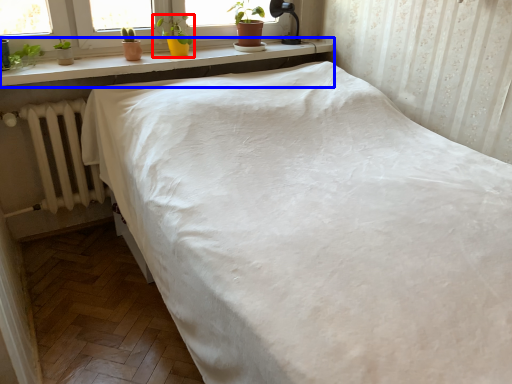
Question: Which of the following is the closest to the observer, houseplant (highlighted by a red box) or window sill (highlighted by a blue box)?

Choices:
 (A) houseplant
 (B) window sill

Answer: (B)